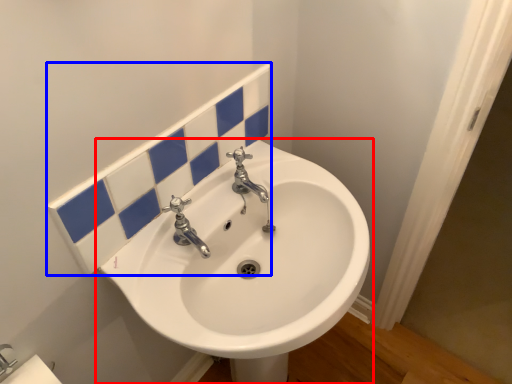
Question: Which of the following is the closest to the observer, sink (highlighted by a red box) or tile (highlighted by a blue box)?

Choices:
 (A) sink
 (B) tile

Answer: (A)